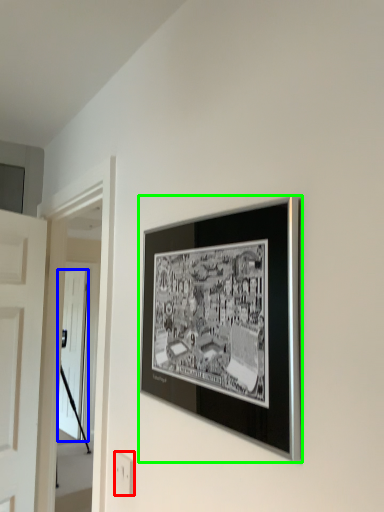
Question: Which object is the farthest from electric outlet (highlighted by a red box)? Choose among these: door (highlighted by a blue box) or picture frame (highlighted by a green box).

Choices:
 (A) door
 (B) picture frame

Answer: (A)